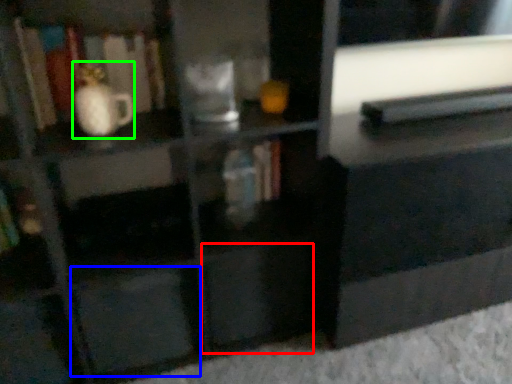
Question: Which object is the closest to the drawer (highlighted by a red box)? Choose among these: drawer (highlighted by a blue box) or vase (highlighted by a green box).

Choices:
 (A) drawer
 (B) vase

Answer: (A)